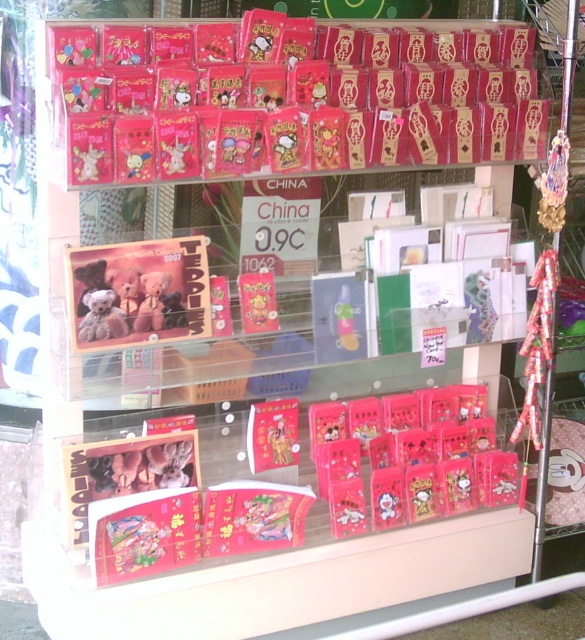
You are organizing a gift display and need to place the matte red card at center and the matte plastic toy at center on a shelf. The shelf has limited space, and you want to ensure both items are visible. Which item should you place first to maximize visibility?

The matte red card at center is larger in size than the matte plastic toy at center, so placing the matte plastic toy at center first and then the matte red card at center will allow both items to be visible without overcrowding the shelf.

You are a customer looking at the display case and want to locate the matte red card at center. According to the coordinates provided, where would you find it?

The matte red card at center is located at point coordinates of (283,440).